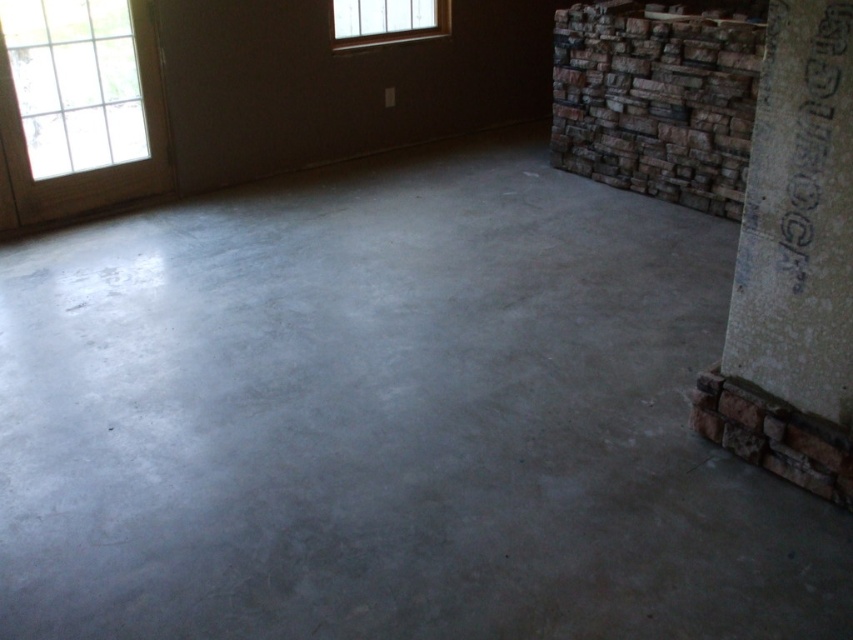
You are an interior designer planning to install a new light fixture in this space. You want to place it above the white concrete pillar at right but ensure it doesn not block the natural light coming through the clear glass window at upper left. Can you do this?

The white concrete pillar at right is located below the clear glass window at upper left, so placing a light fixture above the pillar would not obstruct the window. This placement allows the light to remain functional while preserving the natural light from the clear glass window at upper left.

You are standing in the construction area and need to locate the clear glass window at upper left. Which direction should you look relative to the clear glass window at upper center?

The clear glass window at upper left is located below the clear glass window at upper center, so you should look downward from the clear glass window at upper center to find it.

You are standing in the construction area and want to check the clear glass window at upper left and the clear glass window at upper center. Which window is nearer to you?

The clear glass window at upper left is closer to the viewer than the clear glass window at upper center.